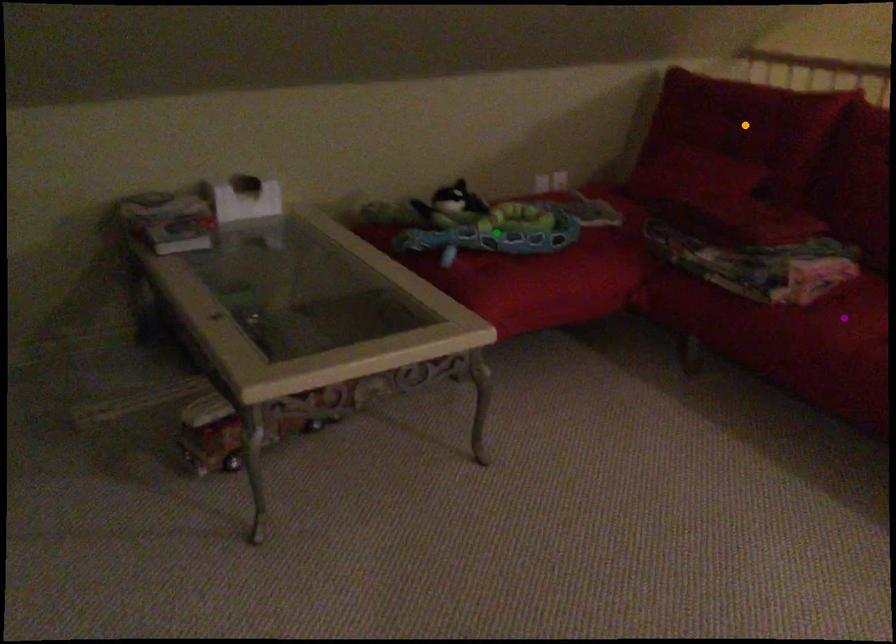
Order these from nearest to farthest:
orange point, green point, purple point

purple point → green point → orange point